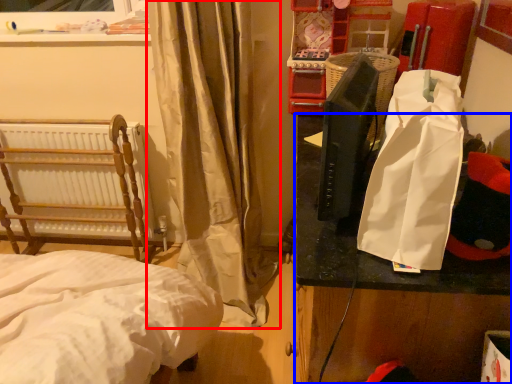
Question: Which point is further to the camera, curtain (highlighted by a red box) or table (highlighted by a blue box)?

Choices:
 (A) curtain
 (B) table

Answer: (A)